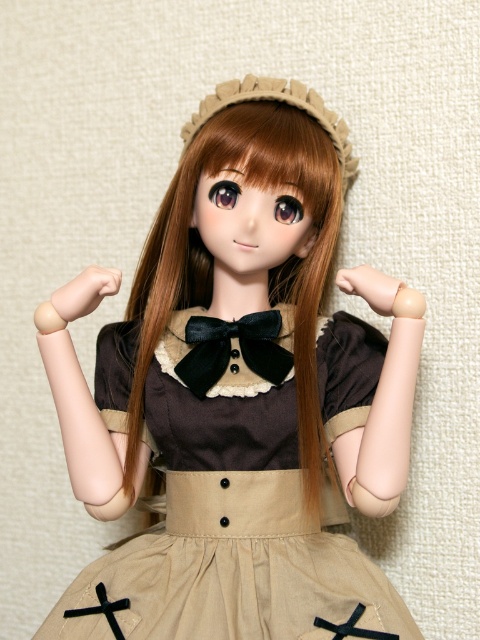
You are a photographer setting up a shot of the doll. You want to focus on the matte brown dress at center without the brown silky hair at center blocking the view. Is this possible given their positions?

The matte brown dress at center is closer to the viewer than the brown silky hair at center, so focusing on the matte brown dress at center would naturally hide the brown silky hair at center from view.

Please describe the exact location of the brown silky hair at center on the doll using coordinates.

The brown silky hair at center is located at coordinates point [268,269].

You are a photographer standing at a certain distance from the matte brown dress at center. You want to take a closeup shot of the dress without moving closer. Your camera has a zoom range of 30 inches. Can you capture the dress in full detail?

The distance between the matte brown dress at center and the viewer is 35.31 inches. Since the camera can zoom up to 30 inches, it cannot fully capture the dress in detail without moving closer.